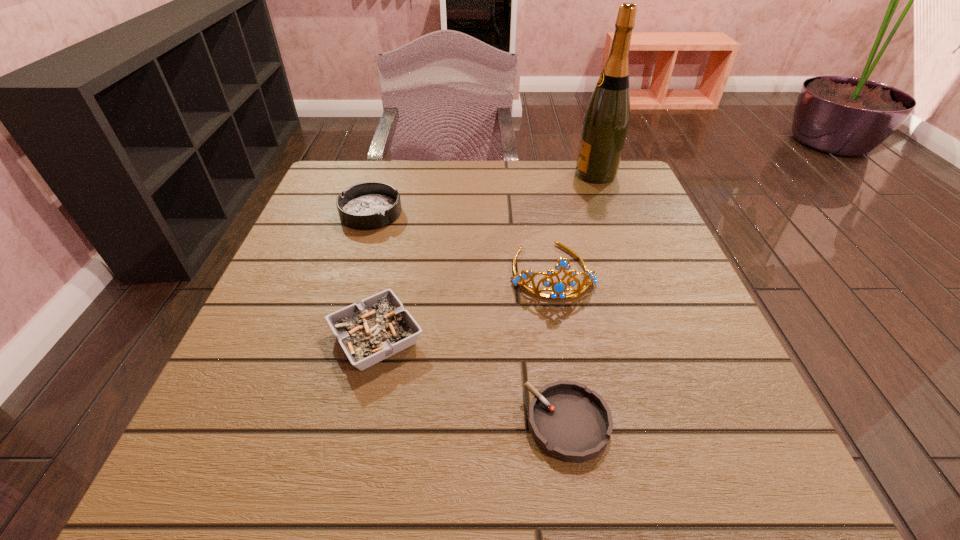
The image size is (960, 540). I want to click on vacant position located 0.160m on the front-facing side of the tiara, so click(x=571, y=377).

Where is `vacant space located on the front of the second farthest object`? Image resolution: width=960 pixels, height=540 pixels. vacant space located on the front of the second farthest object is located at coordinates (342, 305).

Locate an element on the screen. This screenshot has width=960, height=540. vacant space positioned 0.340m on the back of the second nearest ashtray is located at coordinates (406, 199).

This screenshot has width=960, height=540. Find the location of `free space located 0.380m on the left of the rightmost ashtray`. free space located 0.380m on the left of the rightmost ashtray is located at coordinates coord(259,423).

Identify the location of wine bottle at the far edge. (606, 120).

The width and height of the screenshot is (960, 540). Identify the location of ashtray that is at the far edge. (371, 205).

Image resolution: width=960 pixels, height=540 pixels. I want to click on object present at the near edge, so click(x=568, y=421).

At what (x,y) coordinates should I click in order to perform the action: click on object present at the right edge. Please return your answer as a coordinate pair (x, y). The image size is (960, 540). Looking at the image, I should click on (606, 120).

Where is `object situated at the far left corner`? Image resolution: width=960 pixels, height=540 pixels. object situated at the far left corner is located at coordinates (371, 205).

What are the coordinates of `object situated at the far right corner` in the screenshot? It's located at (606, 120).